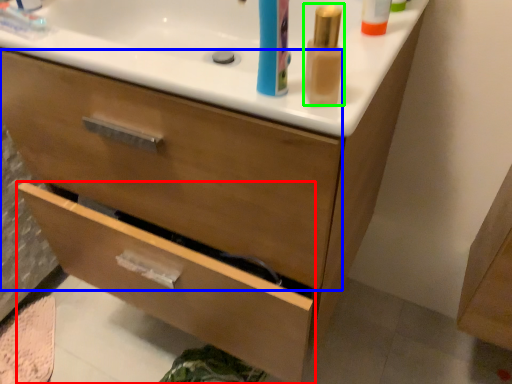
Question: Which is farther away from drawer (highlighted by a red box)? drawer (highlighted by a blue box) or mouthwash (highlighted by a green box)?

Choices:
 (A) drawer
 (B) mouthwash

Answer: (B)